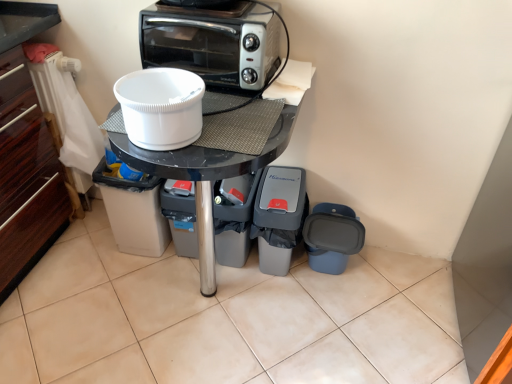
This screenshot has height=384, width=512. I want to click on free spot in front of white plastic bucket at center, the first appliance in the left-to-right sequence, so click(x=130, y=279).